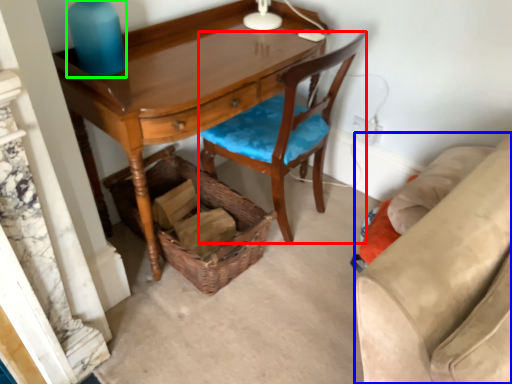
Question: Estimate the real-world distances between objects in this image. Which object is farther from chair (highlighted by a red box), studio couch (highlighted by a blue box) or bottle (highlighted by a green box)?

Choices:
 (A) studio couch
 (B) bottle

Answer: (A)